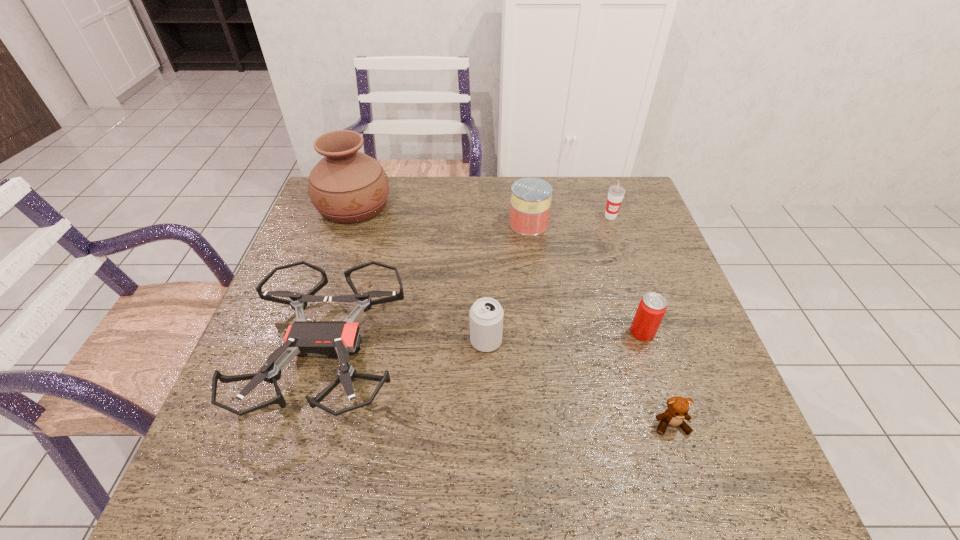
The image size is (960, 540). Find the location of `cup that is at the right edge`. cup that is at the right edge is located at coordinates (616, 193).

The image size is (960, 540). In order to click on can that is at the right edge in this screenshot , I will do `click(652, 307)`.

Image resolution: width=960 pixels, height=540 pixels. Find the location of `teddy bear present at the right edge`. teddy bear present at the right edge is located at coordinates (678, 407).

Find the location of a particular element. The height and width of the screenshot is (540, 960). object that is at the far left corner is located at coordinates (346, 186).

Where is `object that is positioned at the far right corner`? object that is positioned at the far right corner is located at coordinates (616, 193).

Locate an element on the screen. The width and height of the screenshot is (960, 540). vacant position at the far edge of the desktop is located at coordinates click(x=456, y=212).

In the image, there is a desktop. Identify the location of vacant space at the near edge. Image resolution: width=960 pixels, height=540 pixels. (608, 475).

The height and width of the screenshot is (540, 960). I want to click on free space at the left edge of the desktop, so click(310, 247).

Locate an element on the screen. vacant space at the right edge of the desktop is located at coordinates (640, 242).

The image size is (960, 540). In the image, there is a desktop. What are the coordinates of `blank space at the near left corner` in the screenshot? It's located at (204, 475).